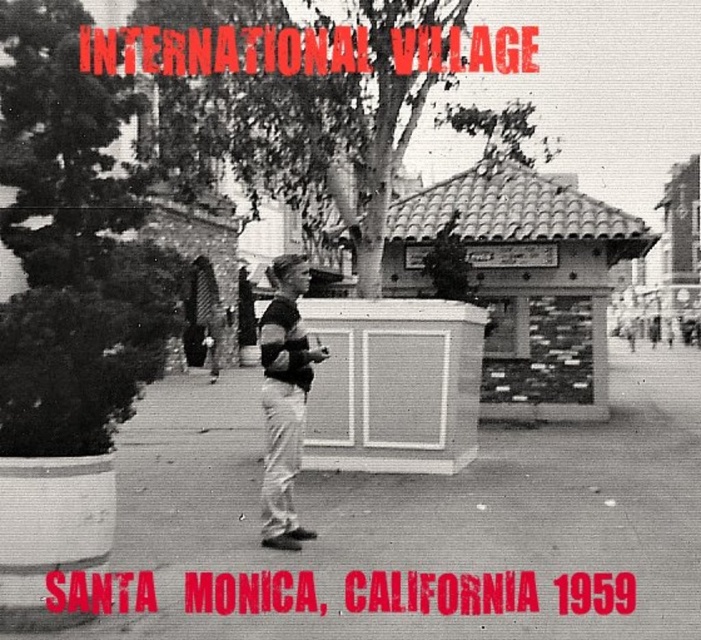
Question: Is smooth concrete pavement at center smaller than matte black shirt at center?

Choices:
 (A) no
 (B) yes

Answer: (B)

Question: Among these points, which one is farthest from the camera?

Choices:
 (A) (325, 531)
 (B) (264, 400)

Answer: (A)

Question: Among these objects, which one is farthest from the camera?

Choices:
 (A) smooth concrete pavement at center
 (B) matte black shirt at center

Answer: (B)

Question: Is smooth concrete pavement at center above matte black shirt at center?

Choices:
 (A) yes
 (B) no

Answer: (B)

Question: Can you confirm if smooth concrete pavement at center is wider than matte black shirt at center?

Choices:
 (A) no
 (B) yes

Answer: (B)